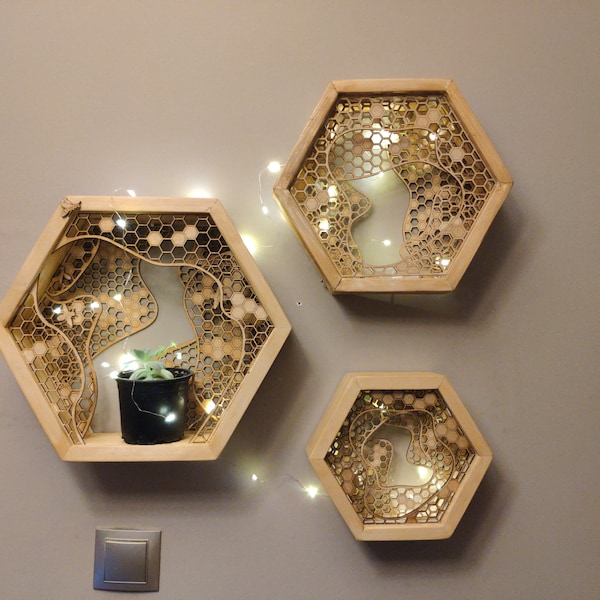
Locate an element on the screen. The image size is (600, 600). string light is located at coordinates (264, 207), (284, 471), (127, 355).